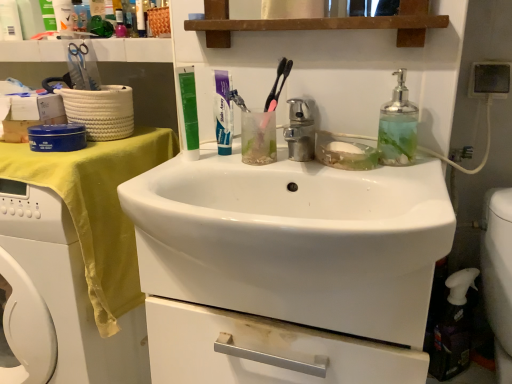
Question: Is green matte toothpaste tube at upper center taller than yellow fabric at left?

Choices:
 (A) no
 (B) yes

Answer: (A)

Question: Is green matte toothpaste tube at upper center bigger than yellow fabric at left?

Choices:
 (A) yes
 (B) no

Answer: (B)

Question: Would you say green matte toothpaste tube at upper center is outside yellow fabric at left?

Choices:
 (A) no
 (B) yes

Answer: (B)

Question: From a real-world perspective, is green matte toothpaste tube at upper center located higher than yellow fabric at left?

Choices:
 (A) no
 (B) yes

Answer: (B)

Question: Does green matte toothpaste tube at upper center have a smaller size compared to yellow fabric at left?

Choices:
 (A) no
 (B) yes

Answer: (B)

Question: Does green matte toothpaste tube at upper center appear on the right side of yellow fabric at left?

Choices:
 (A) no
 (B) yes

Answer: (B)

Question: From a real-world perspective, is yellow fabric at left located beneath green matte toothpaste tube at upper center?

Choices:
 (A) no
 (B) yes

Answer: (B)

Question: Does yellow fabric at left have a greater width compared to green matte toothpaste tube at upper center?

Choices:
 (A) no
 (B) yes

Answer: (B)

Question: Does yellow fabric at left have a larger size compared to green matte toothpaste tube at upper center?

Choices:
 (A) no
 (B) yes

Answer: (B)

Question: Is yellow fabric at left positioned with its back to green matte toothpaste tube at upper center?

Choices:
 (A) yes
 (B) no

Answer: (B)

Question: From the image's perspective, is yellow fabric at left located above green matte toothpaste tube at upper center?

Choices:
 (A) no
 (B) yes

Answer: (A)

Question: Can you confirm if yellow fabric at left is thinner than green matte toothpaste tube at upper center?

Choices:
 (A) yes
 (B) no

Answer: (B)

Question: Can you confirm if white glossy toothpaste at center is shorter than yellow fabric at left?

Choices:
 (A) yes
 (B) no

Answer: (A)